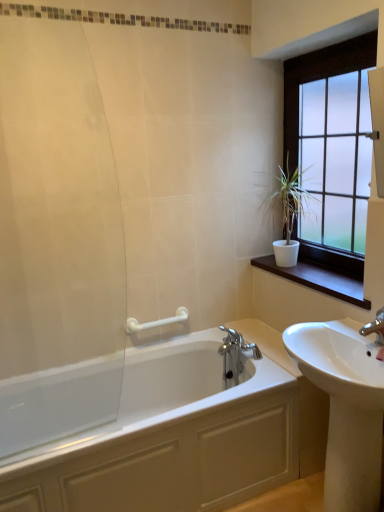
Question: From a real-world perspective, is white matte plant at upper right on top of transparent glass shower door at left?

Choices:
 (A) no
 (B) yes

Answer: (A)

Question: Is white matte plant at upper right at the left side of transparent glass shower door at left?

Choices:
 (A) no
 (B) yes

Answer: (A)

Question: Is white matte plant at upper right smaller than transparent glass shower door at left?

Choices:
 (A) yes
 (B) no

Answer: (B)

Question: Is white matte plant at upper right bigger than transparent glass shower door at left?

Choices:
 (A) yes
 (B) no

Answer: (A)

Question: Does white matte plant at upper right have a lesser width compared to transparent glass shower door at left?

Choices:
 (A) yes
 (B) no

Answer: (B)

Question: In terms of width, does white glossy bathtub at lower left look wider or thinner when compared to satin glass window at upper right?

Choices:
 (A) wide
 (B) thin

Answer: (A)

Question: Considering their positions, is white glossy bathtub at lower left located in front of or behind satin glass window at upper right?

Choices:
 (A) front
 (B) behind

Answer: (A)

Question: From the image's perspective, is white glossy bathtub at lower left positioned above or below satin glass window at upper right?

Choices:
 (A) below
 (B) above

Answer: (A)

Question: Based on their positions, is white glossy bathtub at lower left located to the left or right of satin glass window at upper right?

Choices:
 (A) right
 (B) left

Answer: (B)

Question: In terms of width, does satin glass window at upper right look wider or thinner when compared to white plastic grab bar at upper center?

Choices:
 (A) thin
 (B) wide

Answer: (B)

Question: Is satin glass window at upper right situated inside white plastic grab bar at upper center or outside?

Choices:
 (A) inside
 (B) outside

Answer: (B)

Question: Based on their sizes in the image, would you say satin glass window at upper right is bigger or smaller than white plastic grab bar at upper center?

Choices:
 (A) small
 (B) big

Answer: (B)

Question: Considering the relative positions of satin glass window at upper right and white plastic grab bar at upper center in the image provided, is satin glass window at upper right to the left or to the right of white plastic grab bar at upper center?

Choices:
 (A) right
 (B) left

Answer: (A)

Question: In the image, is white matte plant at upper right positioned in front of or behind white plastic grab bar at upper center?

Choices:
 (A) front
 (B) behind

Answer: (A)

Question: From the image's perspective, relative to white plastic grab bar at upper center, is white matte plant at upper right above or below?

Choices:
 (A) below
 (B) above

Answer: (B)